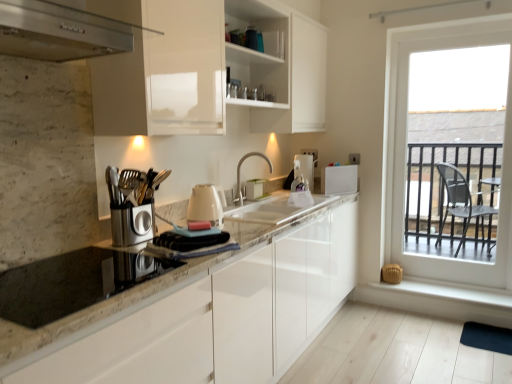
Question: Should I look upward or downward to see white smooth window sill at lower right?

Choices:
 (A) down
 (B) up

Answer: (A)

Question: Can you confirm if white plastic toaster at upper right, placed as the 1th appliance when sorted from right to left, is positioned to the right of granite countertop at center?

Choices:
 (A) yes
 (B) no

Answer: (A)

Question: Does white plastic toaster at upper right, the fourth appliance viewed from the left, have a smaller size compared to granite countertop at center?

Choices:
 (A) no
 (B) yes

Answer: (B)

Question: From a real-world perspective, is white plastic toaster at upper right, placed as the 1th appliance when sorted from right to left, on granite countertop at center?

Choices:
 (A) yes
 (B) no

Answer: (A)

Question: Considering the relative positions of white plastic toaster at upper right, placed as the 1th appliance when sorted from right to left, and granite countertop at center in the image provided, is white plastic toaster at upper right, placed as the 1th appliance when sorted from right to left, to the left of granite countertop at center from the viewer's perspective?

Choices:
 (A) yes
 (B) no

Answer: (B)

Question: Is white plastic toaster at upper right, positioned as the 2th appliance in back-to-front order, completely or partially outside of granite countertop at center?

Choices:
 (A) no
 (B) yes

Answer: (B)

Question: Is white plastic toaster at upper right, positioned as the 2th appliance in back-to-front order, positioned with its back to granite countertop at center?

Choices:
 (A) yes
 (B) no

Answer: (B)

Question: Is white marble sink at center behind satin nickel faucet at center?

Choices:
 (A) yes
 (B) no

Answer: (B)

Question: Does white marble sink at center have a larger size compared to satin nickel faucet at center?

Choices:
 (A) no
 (B) yes

Answer: (B)

Question: Is white marble sink at center smaller than satin nickel faucet at center?

Choices:
 (A) no
 (B) yes

Answer: (A)

Question: From the image's perspective, would you say white marble sink at center is shown under satin nickel faucet at center?

Choices:
 (A) no
 (B) yes

Answer: (B)

Question: Can you confirm if white marble sink at center is shorter than satin nickel faucet at center?

Choices:
 (A) yes
 (B) no

Answer: (A)

Question: Is the position of white marble sink at center less distant than that of satin nickel faucet at center?

Choices:
 (A) no
 (B) yes

Answer: (B)

Question: Can you confirm if white glossy cabinet at upper center is thinner than satin nickel faucet at center?

Choices:
 (A) yes
 (B) no

Answer: (B)